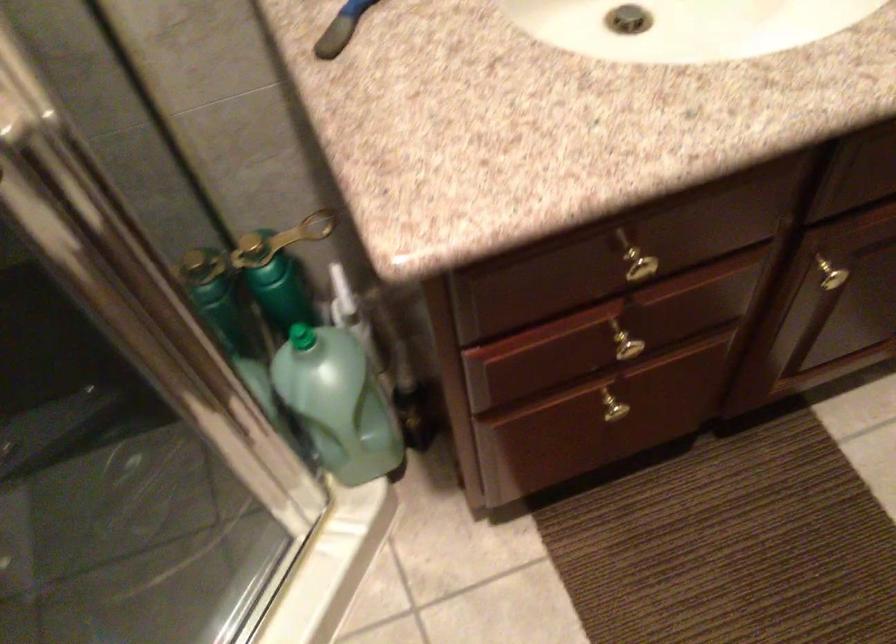
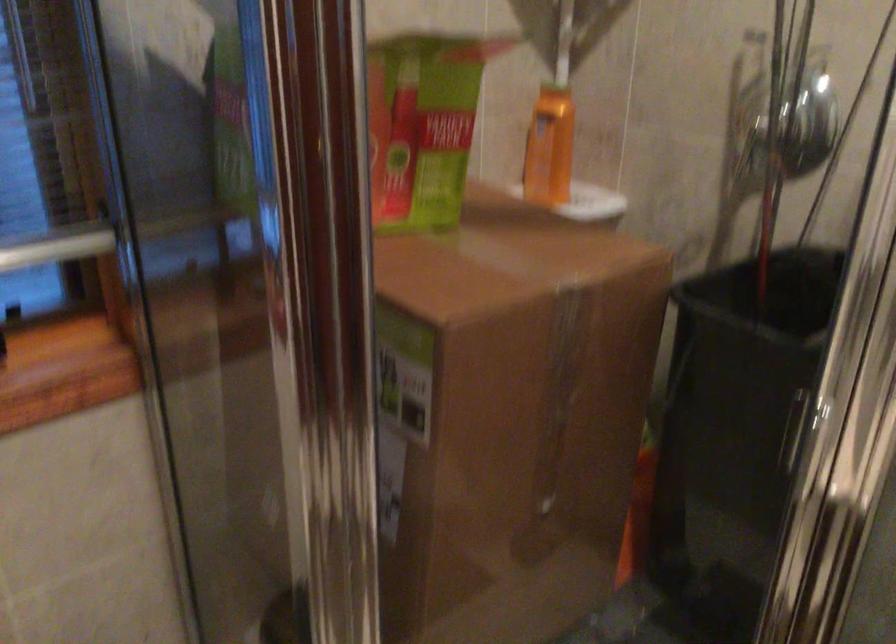
Question: How did the camera likely rotate?

Choices:
 (A) Left
 (B) Right
 (C) Up
 (D) Down

Answer: (A)